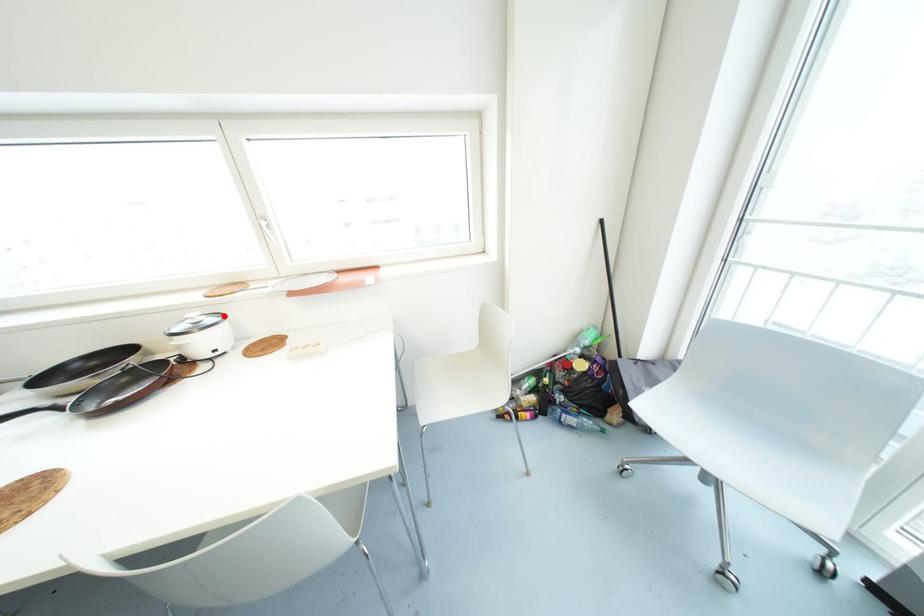
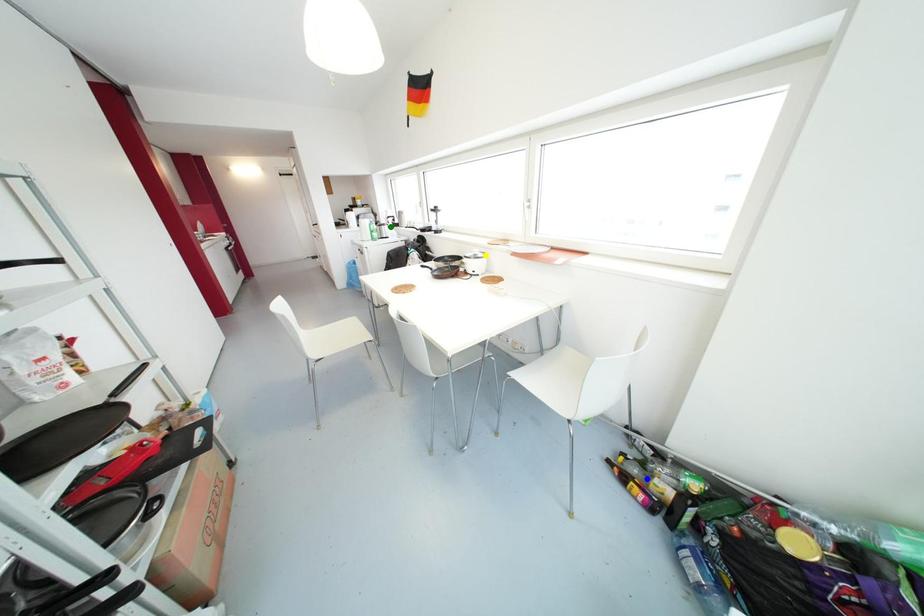
Question: I am providing you with two images of the same scene from different viewpoints. A red point is marked on the first image. You are given multiple points on the second image. Can you choose the point in image 2 that corresponds to the point in image 1?

Choices:
 (A) yellow point
 (B) green point
 (C) blue point

Answer: (A)